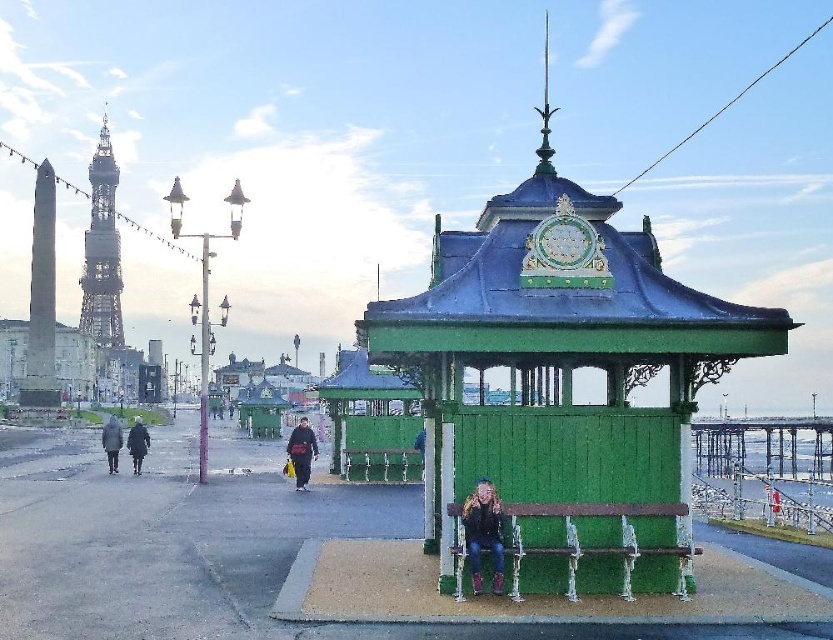
Who is positioned more to the right, smooth gray obelisk at left or dark gray coat at left?

dark gray coat at left is more to the right.

Does smooth gray obelisk at left lie in front of dark gray coat at left?

That is False.

Is point (53, 284) closer to viewer compared to point (133, 422)?

That is False.

This screenshot has width=833, height=640. In order to click on smooth gray obelisk at left in this screenshot , I will do `click(41, 298)`.

Between point (121, 333) and point (232, 403), which one is positioned behind?

Positioned behind is point (121, 333).

Find the location of a particular element. black metal tower at upper left is located at coordinates pyautogui.click(x=102, y=250).

Identify the location of black metal tower at upper left. This screenshot has width=833, height=640. (102, 250).

Where is `black metal tower at upper left`? The height and width of the screenshot is (640, 833). black metal tower at upper left is located at coordinates (102, 250).

Does dark gray wool coat at left appear over dark gray fabric jacket at center?

No, dark gray wool coat at left is not above dark gray fabric jacket at center.

Which is in front, point (108, 465) or point (312, 451)?

Point (312, 451) is in front.

What do you see at coordinates (111, 442) in the screenshot? I see `dark gray wool coat at left` at bounding box center [111, 442].

Where is `dark gray wool coat at left`? This screenshot has width=833, height=640. dark gray wool coat at left is located at coordinates (111, 442).